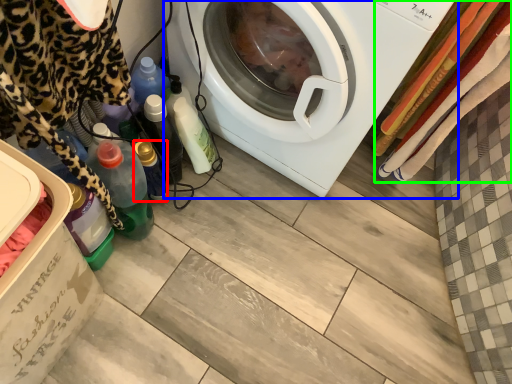
Question: Based on their relative distances, which object is nearer to bottle (highlighted by a red box)? Choose from washing machine (highlighted by a blue box) and blanket (highlighted by a green box).

Choices:
 (A) washing machine
 (B) blanket

Answer: (A)